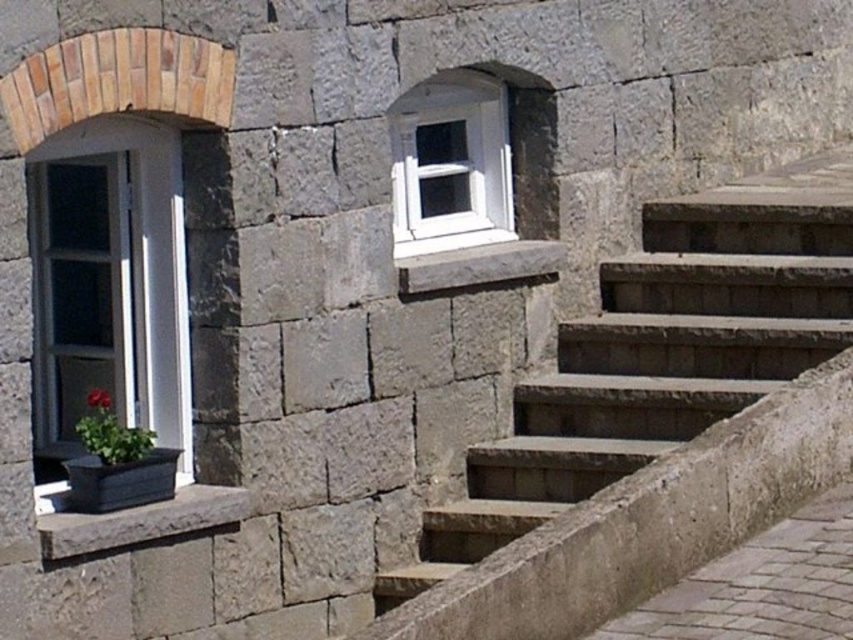
You are standing in front of the stone building and want to locate the white plastic window at upper center. According to the coordinates provided, where would you look to find it?

The white plastic window at upper center is located at coordinates point (450,164).

You are a painter standing on a ladder to paint the stone wall. You need to reach both the matte white window at left and the green matte flower at lower left. Which object should you paint first based on their positions?

You should paint the green matte flower at lower left first because it is positioned lower than the matte white window at left, so it is closer to the ground and easier to reach.